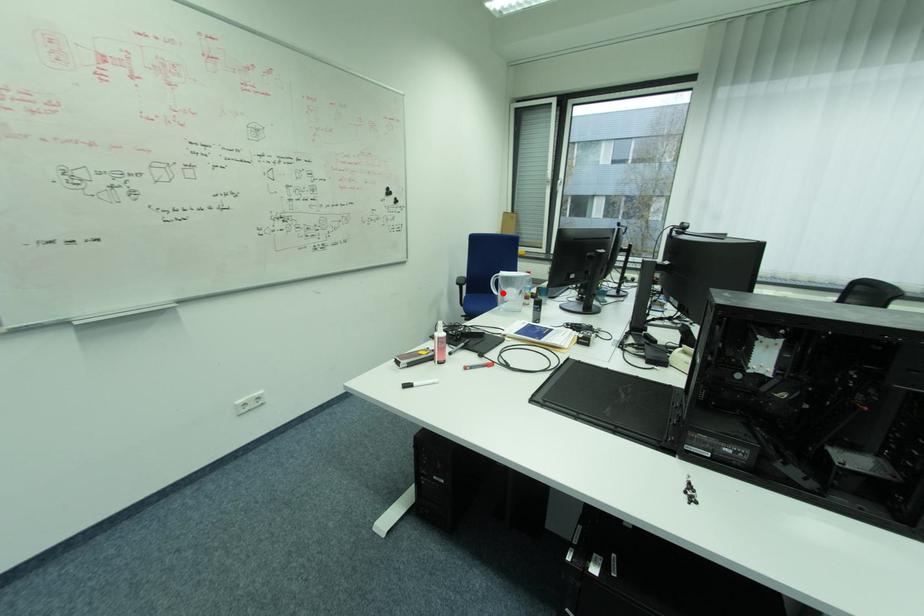
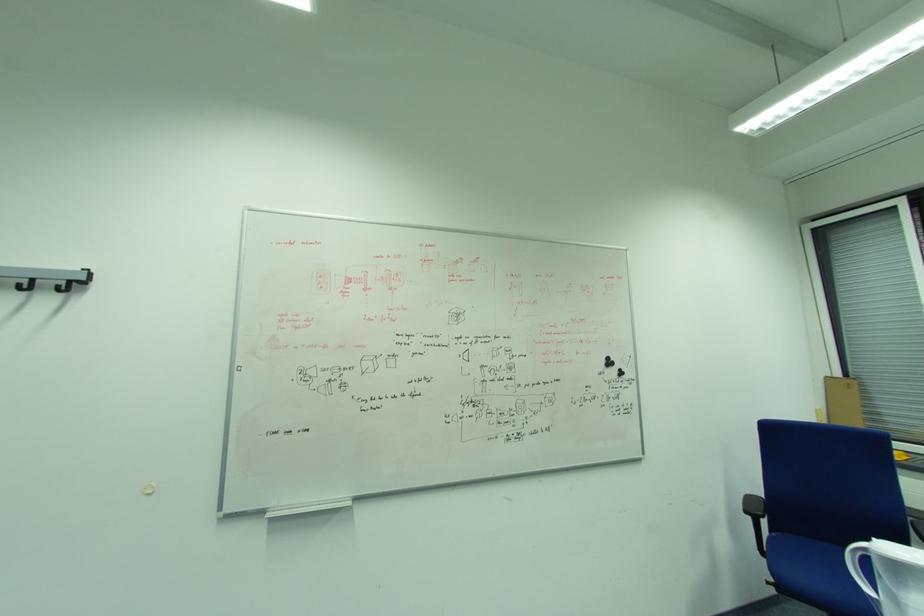
Where in the second image is the point corresponding to the highlighted location from the first image?

(876, 591)